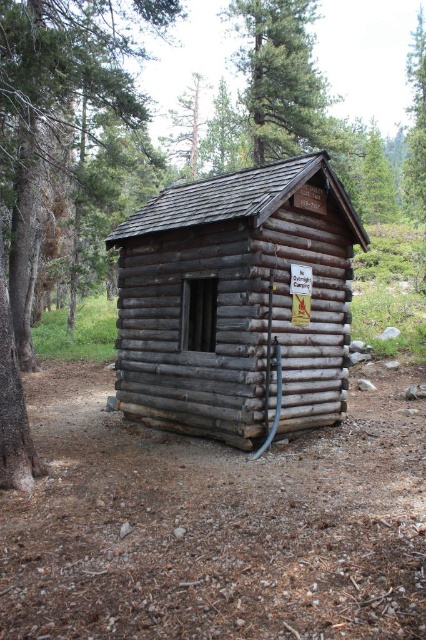
This screenshot has height=640, width=426. Describe the element at coordinates (236, 301) in the screenshot. I see `gray wooden log cabin at center` at that location.

Which is more to the left, gray wooden log cabin at center or smooth brown bark at left?

smooth brown bark at left

Which is in front, point (149, 273) or point (31, 81)?

Point (149, 273) is in front.

The width and height of the screenshot is (426, 640). Find the location of `gray wooden log cabin at center`. gray wooden log cabin at center is located at coordinates (236, 301).

Can you confirm if gray wooden log cabin at center is taller than green leafy tree at upper center?

Incorrect, gray wooden log cabin at center's height is not larger of green leafy tree at upper center's.

Which is below, gray wooden log cabin at center or green leafy tree at upper center?

gray wooden log cabin at center

Describe the element at coordinates (236, 301) in the screenshot. I see `gray wooden log cabin at center` at that location.

The image size is (426, 640). What are the coordinates of `gray wooden log cabin at center` in the screenshot? It's located at [236, 301].

Does smooth brown bark at left have a greater width compared to green leafy tree at upper center?

No, smooth brown bark at left is not wider than green leafy tree at upper center.

Between smooth brown bark at left and green leafy tree at upper center, which one has less height?

smooth brown bark at left is shorter.

What are the coordinates of `smooth brown bark at left` in the screenshot? It's located at (36, 141).

Locate an element on the screen. Image resolution: width=426 pixels, height=640 pixels. smooth brown bark at left is located at coordinates (36, 141).